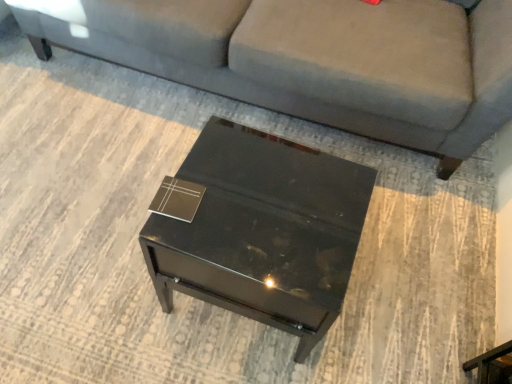
This screenshot has height=384, width=512. I want to click on vacant area on top of glossy black side table at center (from a real-world perspective), so click(x=261, y=199).